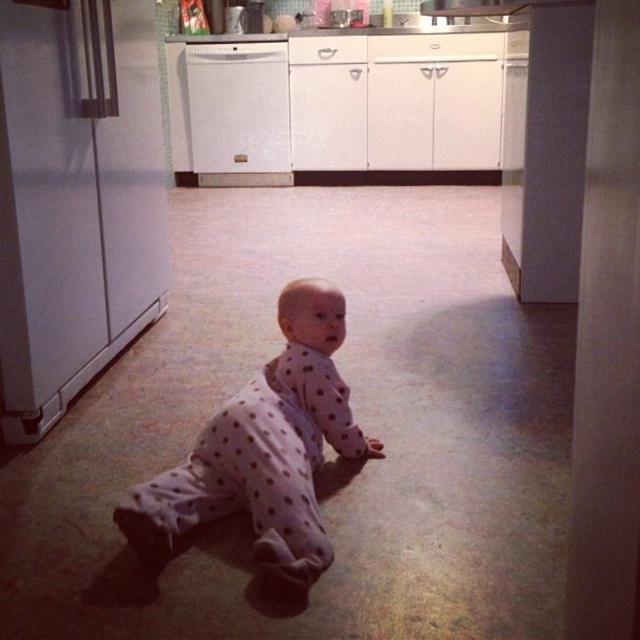
You are a parent in the kitchen and you see the white polka dot onesie at center and the white glossy dishwasher at center. Which object is closer to the floor?

The white polka dot onesie at center is closer to the floor because it is positioned under the white glossy dishwasher at center.

From the picture: You are a parent in the kitchen watching your baby crawling. The baby is wearing the white polka dot onesie at center and near the white glossy dishwasher at center. Which object is closer to you?

The white polka dot onesie at center is closer to the viewer than the white glossy dishwasher at center.